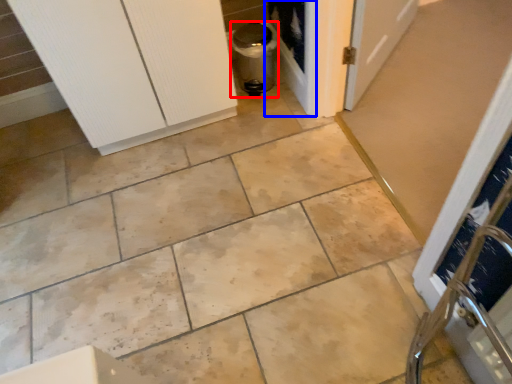
Question: Which point is closer to the camera, appliance (highlighted by a red box) or screen door (highlighted by a blue box)?

Choices:
 (A) appliance
 (B) screen door

Answer: (A)